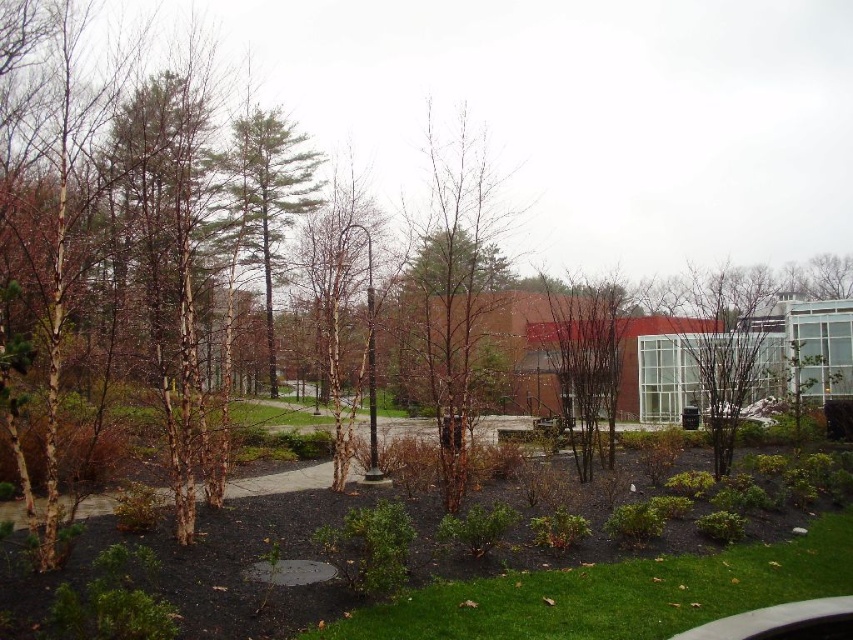
Question: Is bare brown tree at center thinner than bare branches at right?

Choices:
 (A) yes
 (B) no

Answer: (A)

Question: Among these points, which one is farthest from the camera?

Choices:
 (A) (480, 250)
 (B) (708, 317)

Answer: (B)

Question: Is bare brown tree at center smaller than green textured pine tree at center?

Choices:
 (A) yes
 (B) no

Answer: (A)

Question: Is bare brown tree at center smaller than green textured pine tree at center?

Choices:
 (A) no
 (B) yes

Answer: (B)

Question: Which of the following is the farthest from the observer?

Choices:
 (A) bare branches at right
 (B) bare brown tree at center
 (C) bare branches at center
 (D) green textured pine tree at center

Answer: (A)

Question: Which object is the closest to the bare branches at right?

Choices:
 (A) bare brown tree at center
 (B) bare branches at center
 (C) green textured pine tree at center

Answer: (B)